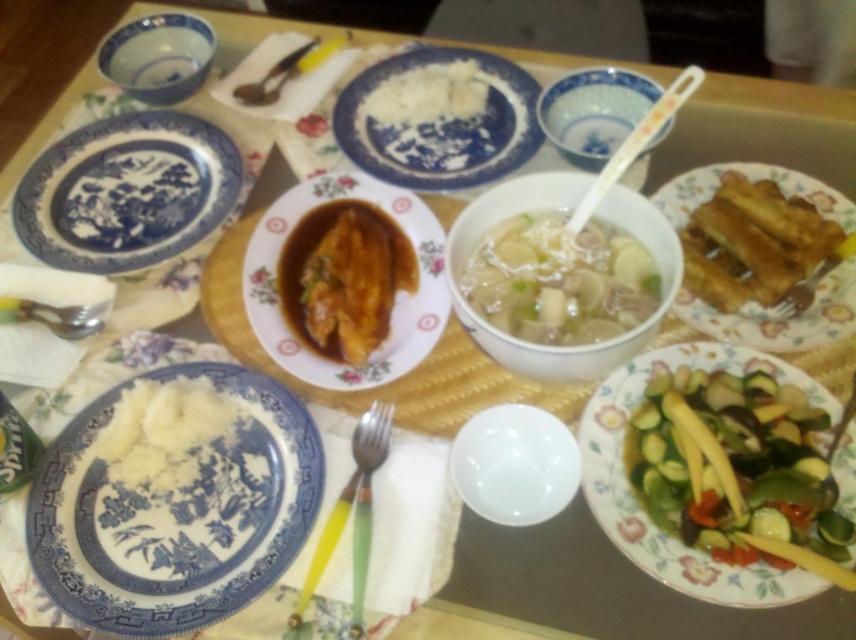
Who is shorter, translucent glass soup at center or golden brown fried fish at right?

translucent glass soup at center

This screenshot has height=640, width=856. What do you see at coordinates (560, 280) in the screenshot?
I see `translucent glass soup at center` at bounding box center [560, 280].

The image size is (856, 640). What are the coordinates of `translucent glass soup at center` in the screenshot? It's located at pyautogui.click(x=560, y=280).

Find the location of a particular element. translucent glass soup at center is located at coordinates (560, 280).

Which is more to the right, porcelain bowl at upper center or silver metallic fork at center?

porcelain bowl at upper center is more to the right.

You are a GUI agent. You are given a task and a screenshot of the screen. Output one action in this format:
    pyautogui.click(x=<x>, y=<y>)
    Task: Click on the porcelain bowl at upper center
    The width and height of the screenshot is (856, 640).
    Given the screenshot: What is the action you would take?
    pyautogui.click(x=593, y=112)

Can you confirm if blue porcelain plate at upper left is positioned to the right of white plastic chopstick at upper center?

In fact, blue porcelain plate at upper left is to the left of white plastic chopstick at upper center.

Based on the photo, is blue porcelain plate at upper left smaller than white plastic chopstick at upper center?

Yes.

Is point (33, 243) positioned before point (575, 228)?

No, it is not.

Find the location of a particular element. This screenshot has width=856, height=640. blue porcelain plate at upper left is located at coordinates (126, 192).